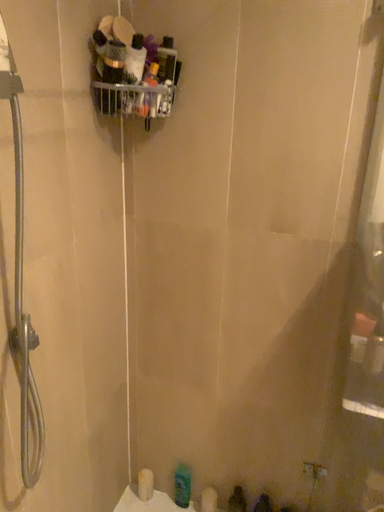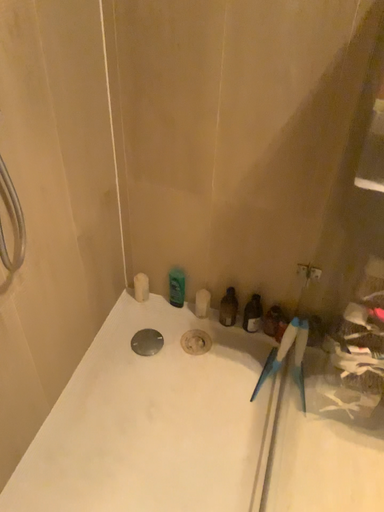
Question: How did the camera likely rotate when shooting the video?

Choices:
 (A) rotated upward
 (B) rotated downward

Answer: (B)